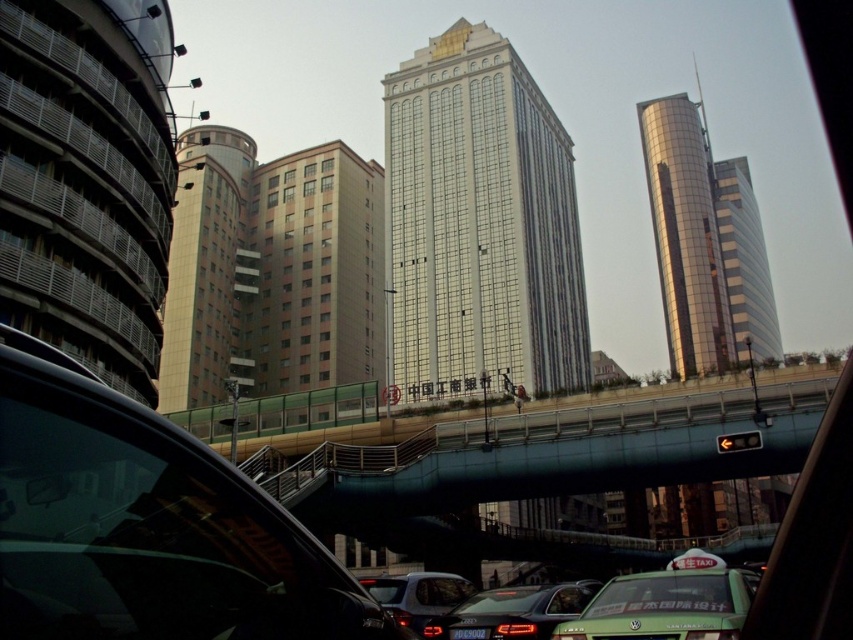
You are a delivery drone operator. Your drone needs to fly from the glossy glass tower at upper right to the matte black car at center. Which direction should you direct the drone to move first?

The glossy glass tower at upper right is further to the viewer than the matte black car at center, so the drone should first move backward to descend towards the matte black car at center.

You are a pedestrian standing on the walkway on the left side of the frame. You want to cross the street to the walkway on the right. The green matte taxi at lower right and the glossy glass tower at upper right are in your line of sight. Which object should you look out for to ensure you can safely cross the street?

You should look out for the green matte taxi at lower right because it is closer to you than the glossy glass tower at upper right, so it poses a potential traffic hazard during your crossing.

You are a delivery person needing to reach the beige textured building at center from your current position near the green matte taxi at lower right. Based on the scene, which direction should you head to reach the building?

The beige textured building at center is located above the green matte taxi at lower right, so you should head upwards or towards higher elevation to reach it.